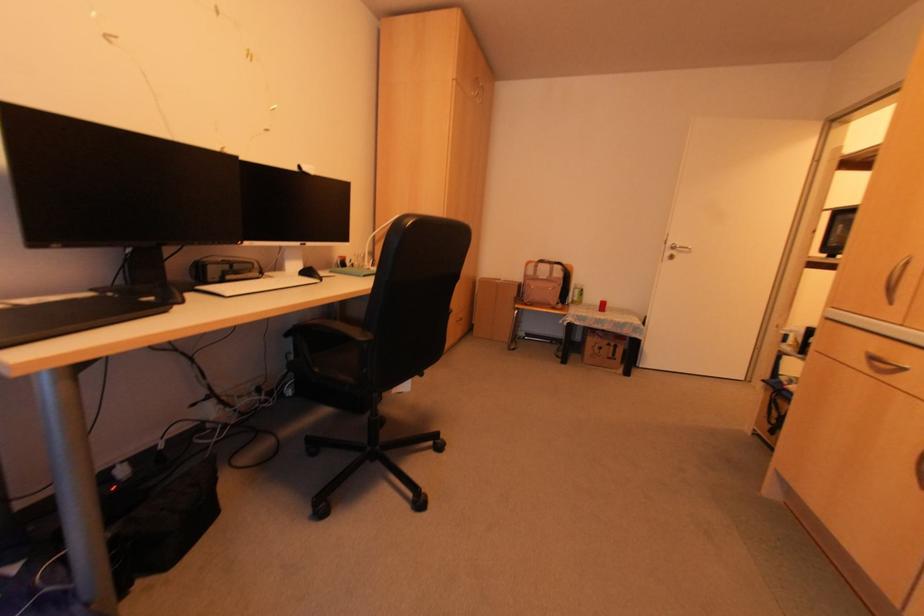
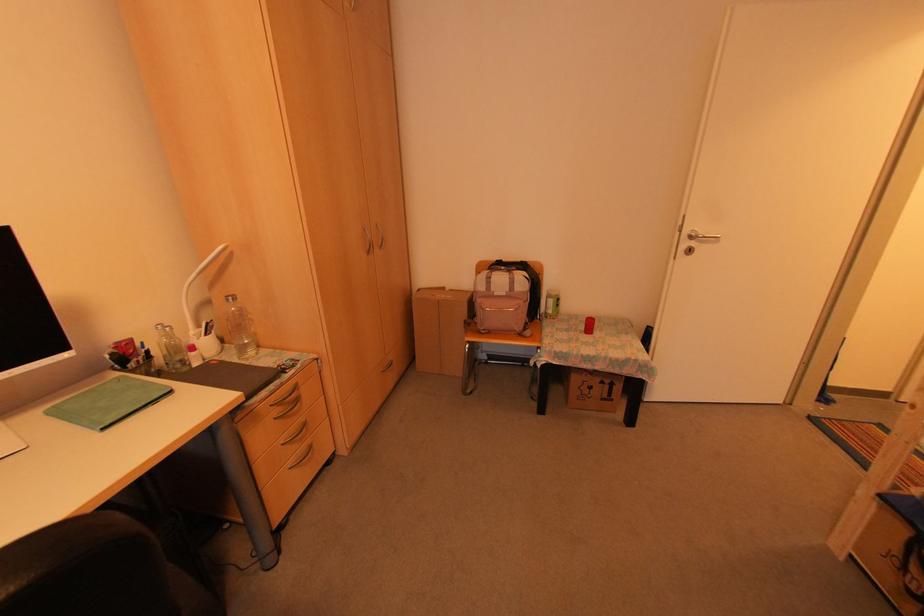
In the second image, find the point that corresponds to pixel 523 301 in the first image.

(477, 326)